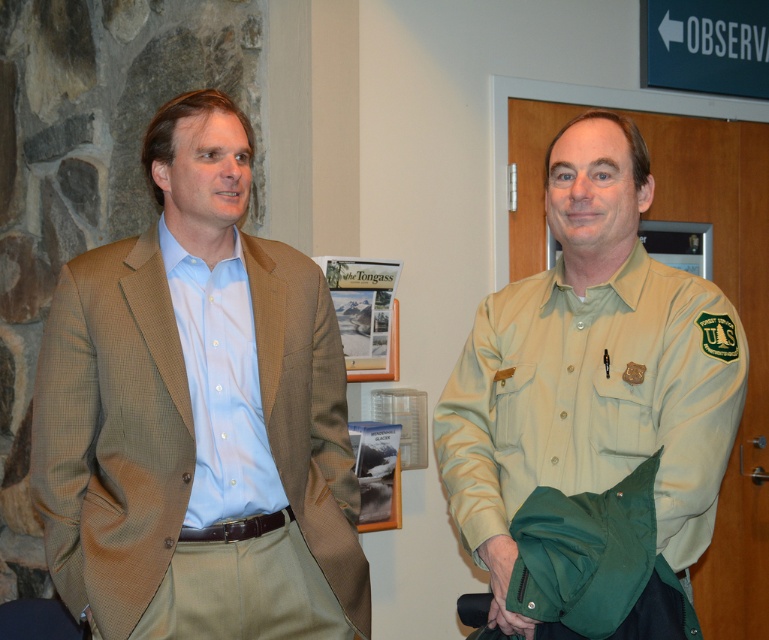
Is light brown textured blazer at left bigger than khaki uniform shirt at right?

Yes.

Does light brown textured blazer at left appear under khaki uniform shirt at right?

Correct, light brown textured blazer at left is located below khaki uniform shirt at right.

The image size is (769, 640). In order to click on light brown textured blazer at left in this screenshot , I will do `click(197, 413)`.

I want to click on light brown textured blazer at left, so click(197, 413).